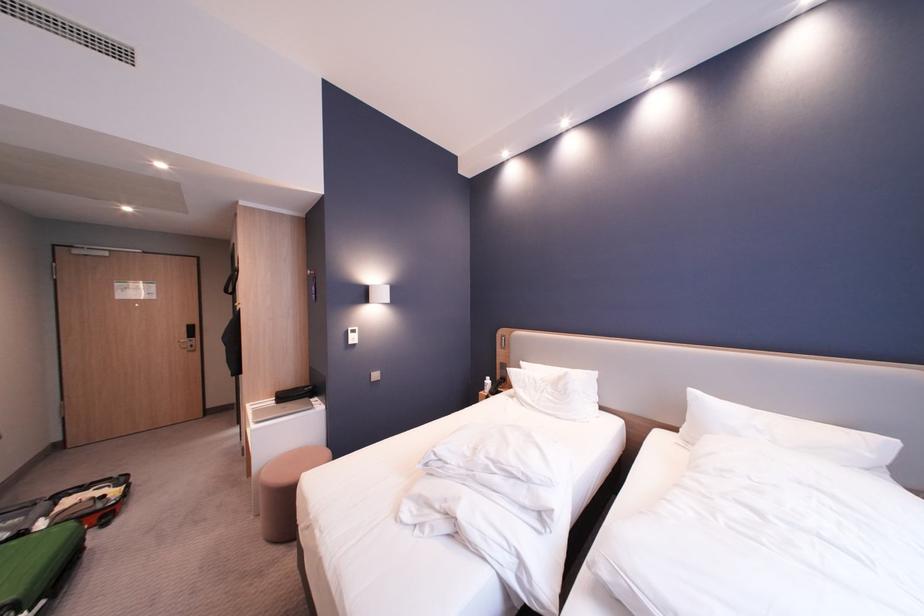
Where would you lift the closed silver laptop? Please return your answer as a coordinate pair (x, y).

(277, 410)